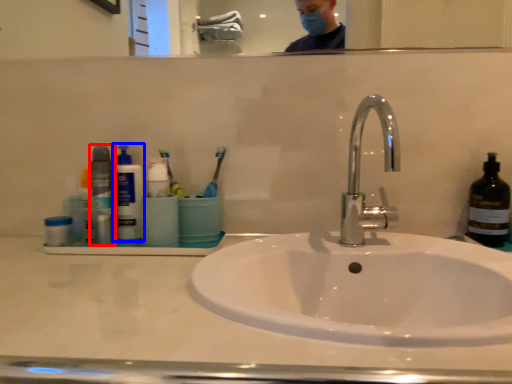
Question: Which object is further to the camera taking this photo, bottle (highlighted by a red box) or cleaning product (highlighted by a blue box)?

Choices:
 (A) bottle
 (B) cleaning product

Answer: (B)